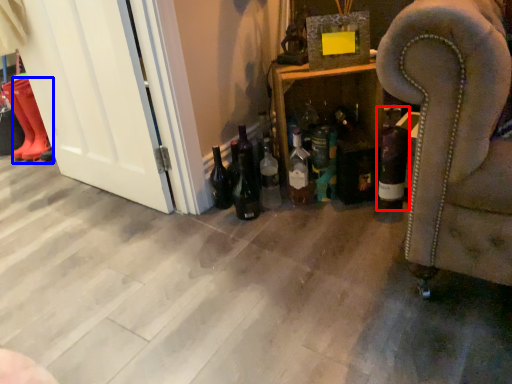
Question: Which of the following is the closest to the observer, bottle (highlighted by a red box) or boot (highlighted by a blue box)?

Choices:
 (A) bottle
 (B) boot

Answer: (A)